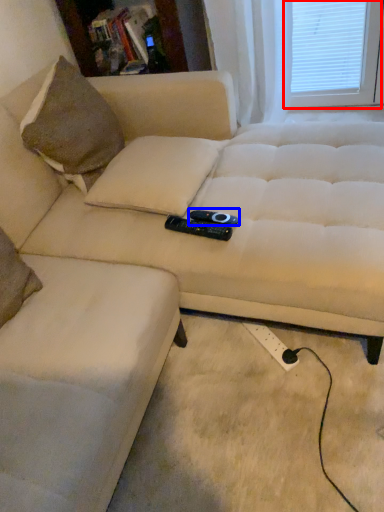
Question: Among these objects, which one is nearest to the camera, window screen (highlighted by a red box) or remote (highlighted by a blue box)?

Choices:
 (A) window screen
 (B) remote

Answer: (B)